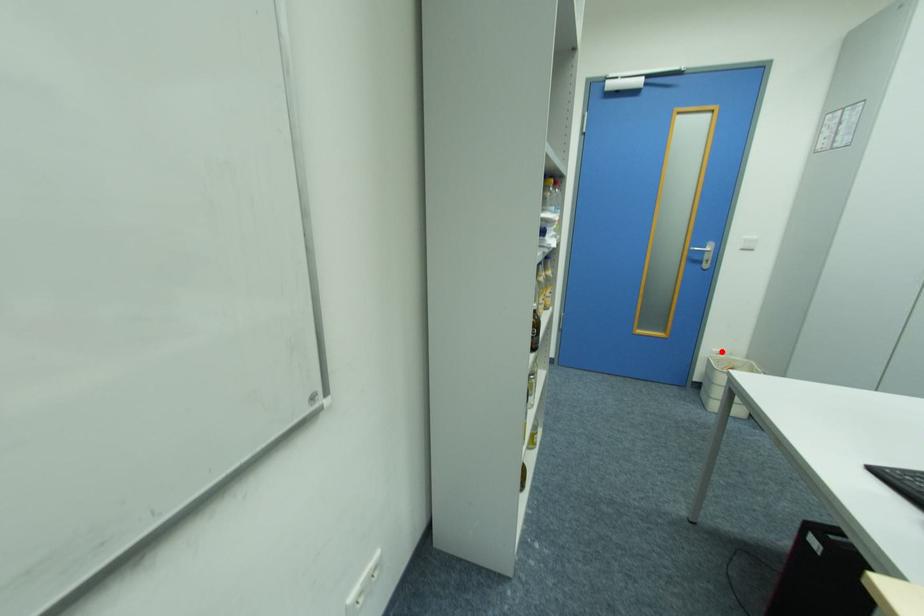
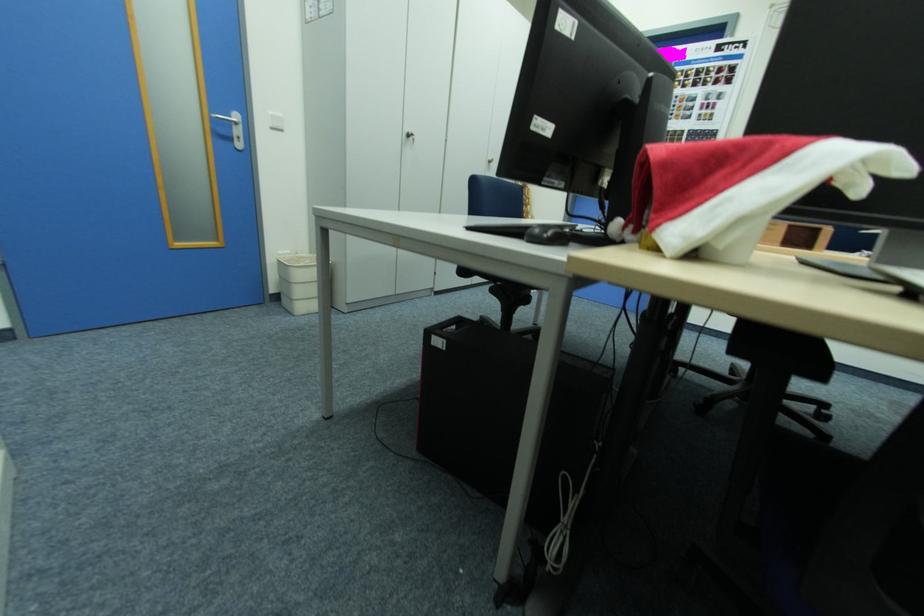
Question: I am providing you with two images of the same scene from different viewpoints. Image1 has a red point marked. In image2, the corresponding 3D location appears at what relative position? Reply with the corresponding letter.

Choices:
 (A) Closer
 (B) Farther

Answer: (B)